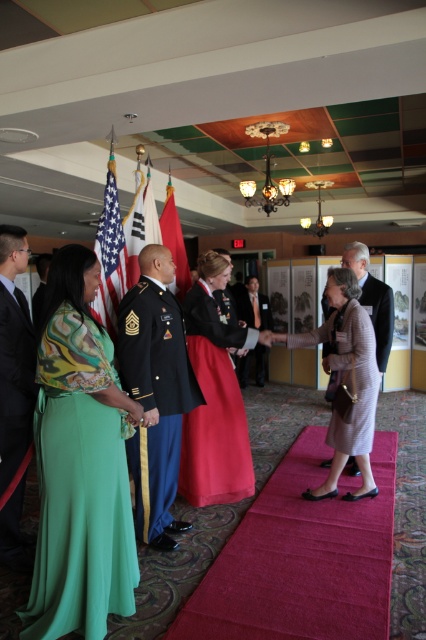
You are a photographer at the event and need to frame a shot that includes both the green satin dress at left and the light brown textured dress at center. Given their sizes, which dress should you ensure is closer to the camera to maintain their relative sizes in the photo?

Since the green satin dress at left is smaller than the light brown textured dress at center, to maintain their relative sizes in the photo, the green satin dress at left should be closer to the camera while the light brown textured dress at center should be further away.

You are a photographer at the event and want to take a closeup of the two points of interest marked as point (363, 308) and point (368, 433). Which point should you focus on to ensure it appears larger in the photo?

Point (363, 308) is closer to the camera than point (368, 433), so focusing on it will make it appear larger in the photo.